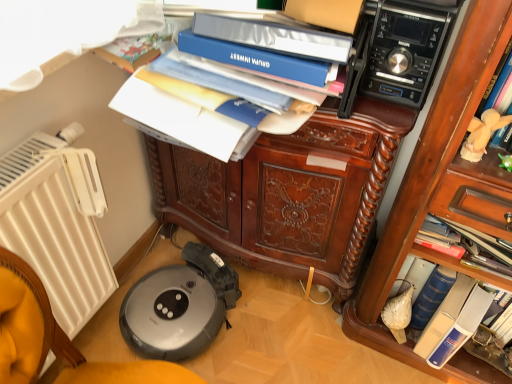
Question: From a real-world perspective, is blue hardcover book at lower right on black plastic stereo at upper right?

Choices:
 (A) no
 (B) yes

Answer: (A)

Question: Is black plastic stereo at upper right inside blue hardcover book at lower right?

Choices:
 (A) yes
 (B) no

Answer: (B)

Question: Considering the relative sizes of blue hardcover book at lower right and black plastic stereo at upper right in the image provided, is blue hardcover book at lower right smaller than black plastic stereo at upper right?

Choices:
 (A) yes
 (B) no

Answer: (B)

Question: Considering the relative sizes of blue hardcover book at lower right and black plastic stereo at upper right in the image provided, is blue hardcover book at lower right thinner than black plastic stereo at upper right?

Choices:
 (A) no
 (B) yes

Answer: (A)

Question: Is blue hardcover book at lower right behind black plastic stereo at upper right?

Choices:
 (A) yes
 (B) no

Answer: (A)

Question: Is blue hardcover book at lower right far away from black plastic stereo at upper right?

Choices:
 (A) yes
 (B) no

Answer: (B)

Question: Considering the relative sizes of blue hardcover book at lower right and white plush toy at upper right in the image provided, is blue hardcover book at lower right taller than white plush toy at upper right?

Choices:
 (A) no
 (B) yes

Answer: (B)

Question: Is blue hardcover book at lower right in contact with white plush toy at upper right?

Choices:
 (A) no
 (B) yes

Answer: (A)

Question: From a real-world perspective, does blue hardcover book at lower right stand above white plush toy at upper right?

Choices:
 (A) no
 (B) yes

Answer: (A)

Question: Can you confirm if blue hardcover book at lower right is positioned to the left of white plush toy at upper right?

Choices:
 (A) yes
 (B) no

Answer: (B)

Question: From the image's perspective, is blue hardcover book at lower right on top of white plush toy at upper right?

Choices:
 (A) no
 (B) yes

Answer: (A)

Question: Is blue hardcover book at lower right turned away from white plush toy at upper right?

Choices:
 (A) yes
 (B) no

Answer: (B)

Question: Is the depth of blue hardcover book at lower right, the 1th paperback book from the back, greater than that of white plastic radiator at left?

Choices:
 (A) no
 (B) yes

Answer: (B)